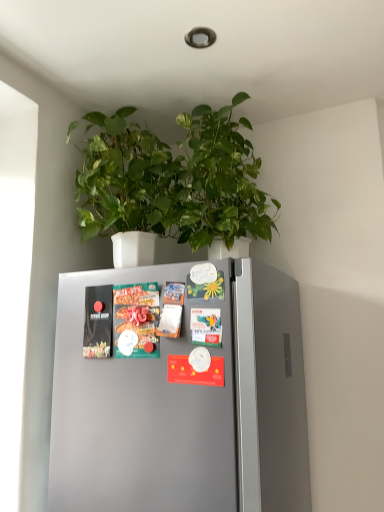
I want to click on vacant space situated above green glossy leaves at upper center (from a real-world perspective), so click(x=179, y=90).